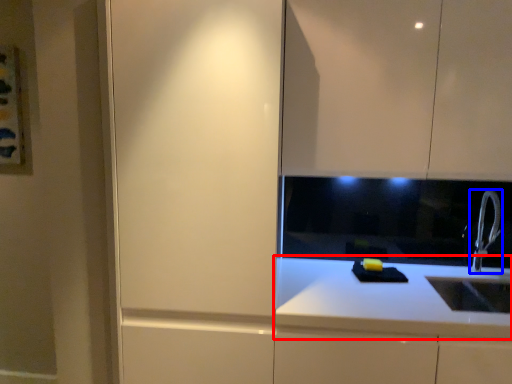
Question: Among these objects, which one is nearest to the camera, countertop (highlighted by a red box) or tap (highlighted by a blue box)?

Choices:
 (A) countertop
 (B) tap

Answer: (A)